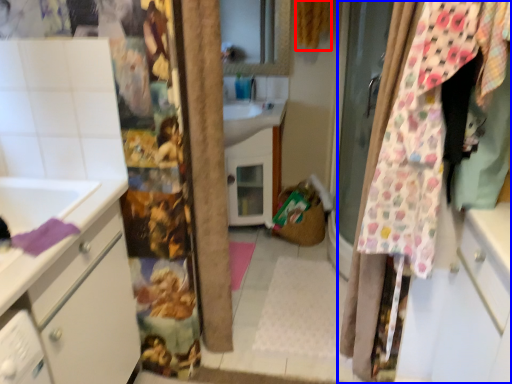
Question: Which object is further to the camera taking this photo, curtain (highlighted by a red box) or curtain (highlighted by a blue box)?

Choices:
 (A) curtain
 (B) curtain

Answer: (A)